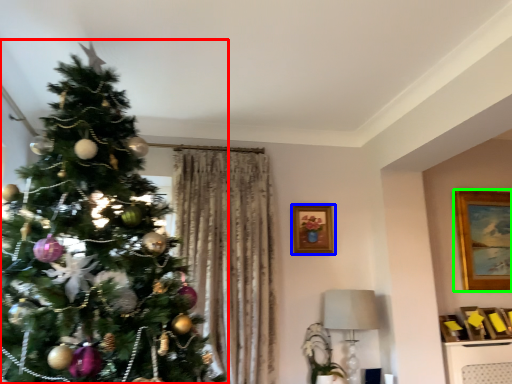
Question: Which is nearer to the christmas tree (highlighted by a red box)? picture frame (highlighted by a blue box) or picture frame (highlighted by a green box).

Choices:
 (A) picture frame
 (B) picture frame

Answer: (A)